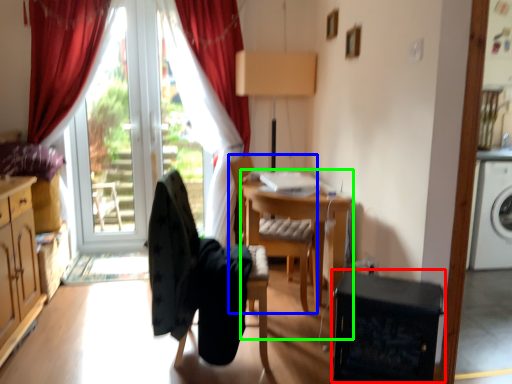
Question: Considering the real-world distances, which object is farthest from dish washer (highlighted by a red box)? chair (highlighted by a blue box) or computer desk (highlighted by a green box)?

Choices:
 (A) chair
 (B) computer desk

Answer: (A)